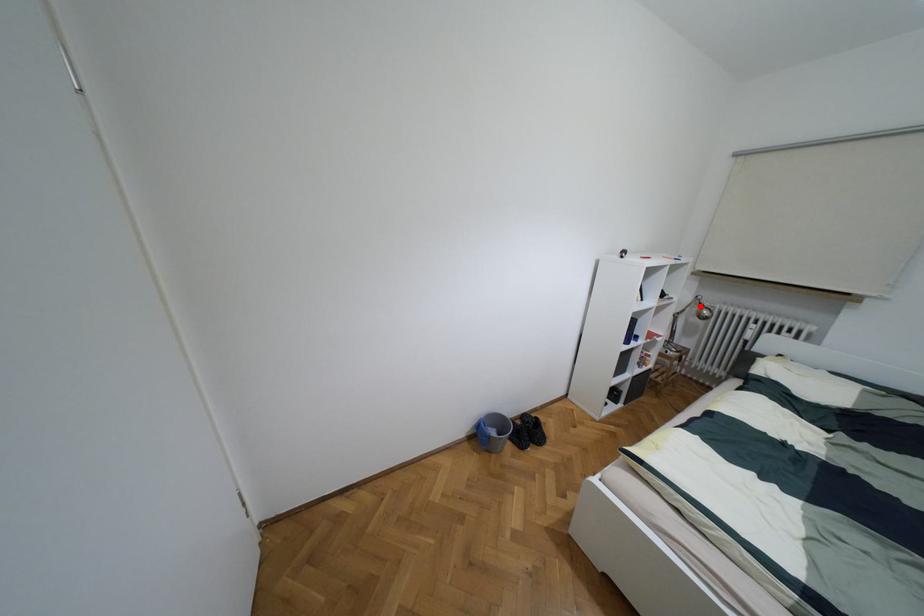
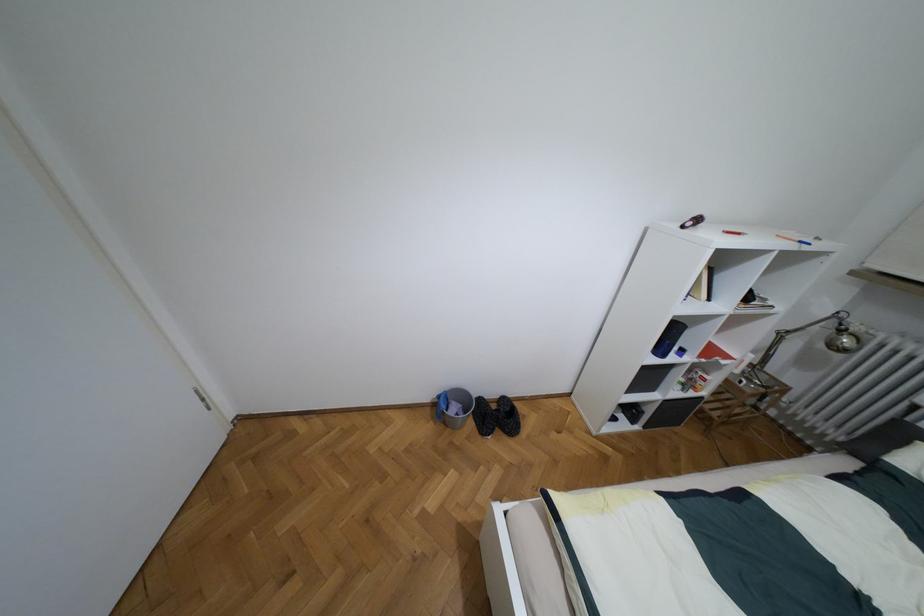
Find the pixel in the second image that matches the highlighted location in the first image.

(840, 330)